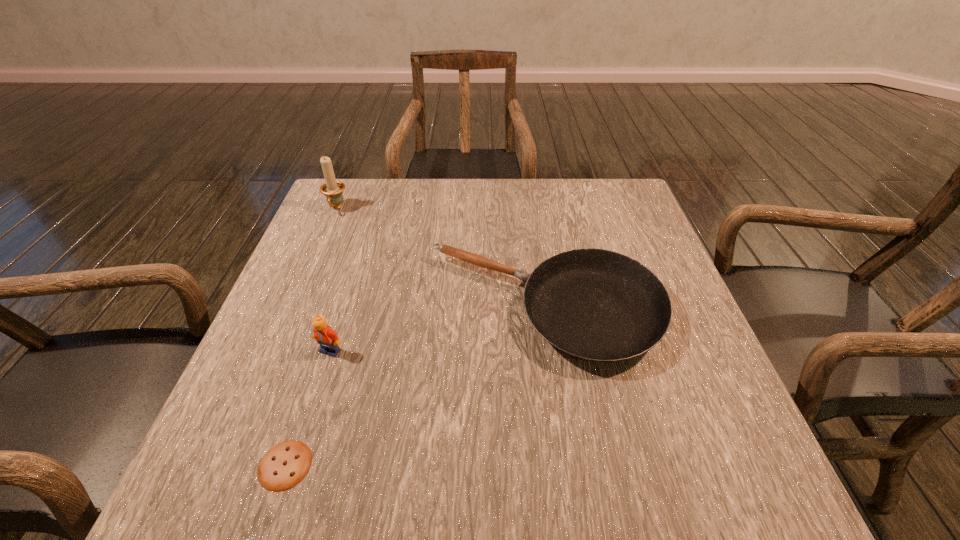
Where is `vacant area in the image that satisfies the following two spatial constraints: 1. on the handle side of the tallest object; 2. on the right side of the nearest object`? The height and width of the screenshot is (540, 960). vacant area in the image that satisfies the following two spatial constraints: 1. on the handle side of the tallest object; 2. on the right side of the nearest object is located at coordinates (229, 465).

Where is `vacant area that satisfies the following two spatial constraints: 1. on the handle side of the nearest object; 2. on the right side of the leftmost object`? The image size is (960, 540). vacant area that satisfies the following two spatial constraints: 1. on the handle side of the nearest object; 2. on the right side of the leftmost object is located at coordinates (229, 465).

Locate an element on the screen. Image resolution: width=960 pixels, height=540 pixels. vacant region that satisfies the following two spatial constraints: 1. on the handle side of the tallest object; 2. on the left side of the frying pan is located at coordinates (295, 308).